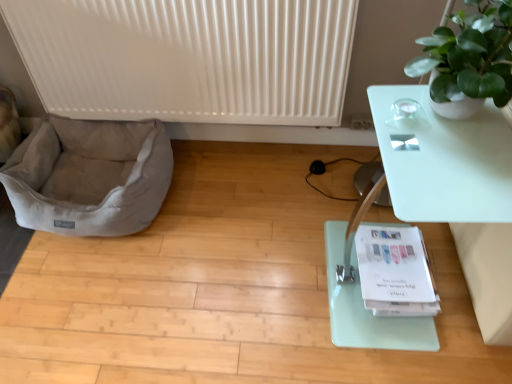
Question: Is transparent glass table at right not within light gray fabric dog bed at lower left?

Choices:
 (A) yes
 (B) no

Answer: (A)

Question: Is light gray fabric dog bed at lower left inside transparent glass table at right?

Choices:
 (A) yes
 (B) no

Answer: (B)

Question: From the image's perspective, is transparent glass table at right located above light gray fabric dog bed at lower left?

Choices:
 (A) no
 (B) yes

Answer: (A)

Question: Considering the relative positions of transparent glass table at right and light gray fabric dog bed at lower left in the image provided, is transparent glass table at right in front of light gray fabric dog bed at lower left?

Choices:
 (A) yes
 (B) no

Answer: (A)

Question: Considering the relative sizes of transparent glass table at right and light gray fabric dog bed at lower left in the image provided, is transparent glass table at right smaller than light gray fabric dog bed at lower left?

Choices:
 (A) no
 (B) yes

Answer: (A)

Question: Does point (87, 205) appear closer or farther from the camera than point (378, 102)?

Choices:
 (A) closer
 (B) farther

Answer: (B)

Question: In terms of width, does light gray fabric dog bed at lower left look wider or thinner when compared to transparent glass table at right?

Choices:
 (A) wide
 (B) thin

Answer: (A)

Question: Considering their positions, is light gray fabric dog bed at lower left located in front of or behind transparent glass table at right?

Choices:
 (A) behind
 (B) front

Answer: (A)

Question: From a real-world perspective, relative to transparent glass table at right, is light gray fabric dog bed at lower left vertically above or below?

Choices:
 (A) above
 (B) below

Answer: (B)

Question: In the image, is white ribbed radiator at upper center positioned in front of or behind white paper yoga mat at lower center?

Choices:
 (A) front
 (B) behind

Answer: (B)

Question: Considering the positions of white ribbed radiator at upper center and white paper yoga mat at lower center in the image, is white ribbed radiator at upper center taller or shorter than white paper yoga mat at lower center?

Choices:
 (A) tall
 (B) short

Answer: (A)

Question: Considering the positions of point (82, 34) and point (425, 347), is point (82, 34) closer or farther from the camera than point (425, 347)?

Choices:
 (A) farther
 (B) closer

Answer: (A)

Question: From a real-world perspective, is white ribbed radiator at upper center positioned above or below white paper yoga mat at lower center?

Choices:
 (A) above
 (B) below

Answer: (A)

Question: In the image, is white paper yoga mat at lower center positioned in front of or behind white ribbed radiator at upper center?

Choices:
 (A) front
 (B) behind

Answer: (A)

Question: In terms of height, does white paper yoga mat at lower center look taller or shorter compared to white ribbed radiator at upper center?

Choices:
 (A) tall
 (B) short

Answer: (B)